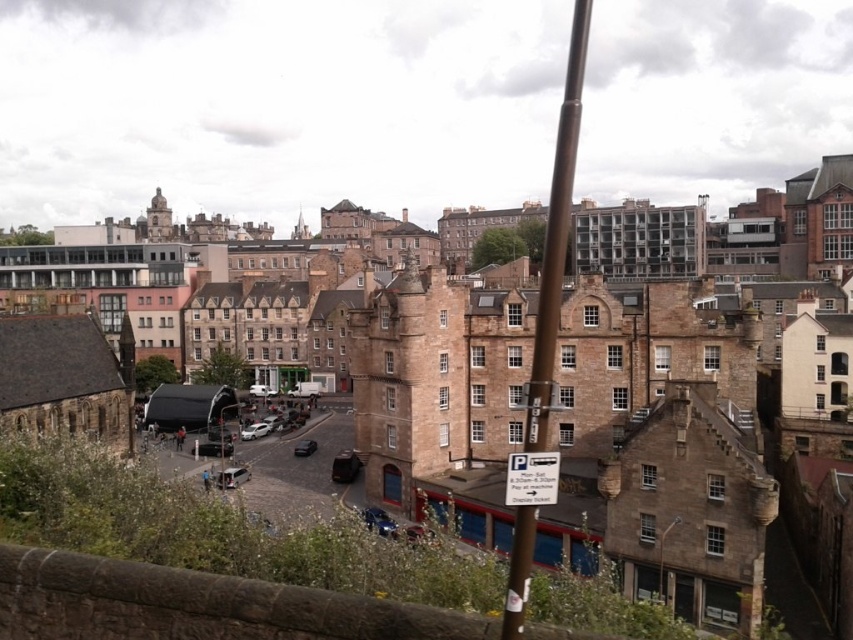
Question: Does white plastic parking sign at lower center appear on the left side of shiny black car at center?

Choices:
 (A) no
 (B) yes

Answer: (A)

Question: Which point is closer to the camera?

Choices:
 (A) silver metallic car at center
 (B) shiny black car at center

Answer: (B)

Question: Which is farther from the shiny black car at center?

Choices:
 (A) silver metallic car at center
 (B) brown metallic pole at center

Answer: (B)

Question: Does brown metallic pole at center have a smaller size compared to white plastic parking sign at lower center?

Choices:
 (A) yes
 (B) no

Answer: (B)

Question: Estimate the real-world distances between objects in this image. Which object is closer to the white plastic parking sign at lower center?

Choices:
 (A) brown metallic pole at center
 (B) silver metallic car at center
 (C) shiny black car at center

Answer: (C)

Question: Observing the image, what is the correct spatial positioning of brown metallic pole at center in reference to shiny black car at center?

Choices:
 (A) left
 (B) right

Answer: (B)